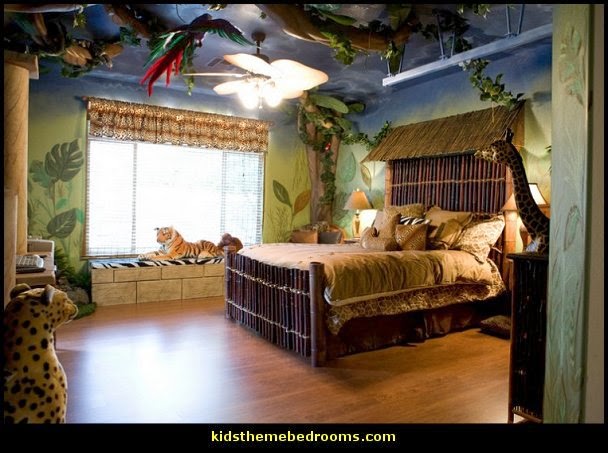
The width and height of the screenshot is (608, 453). I want to click on pillar, so click(15, 115).